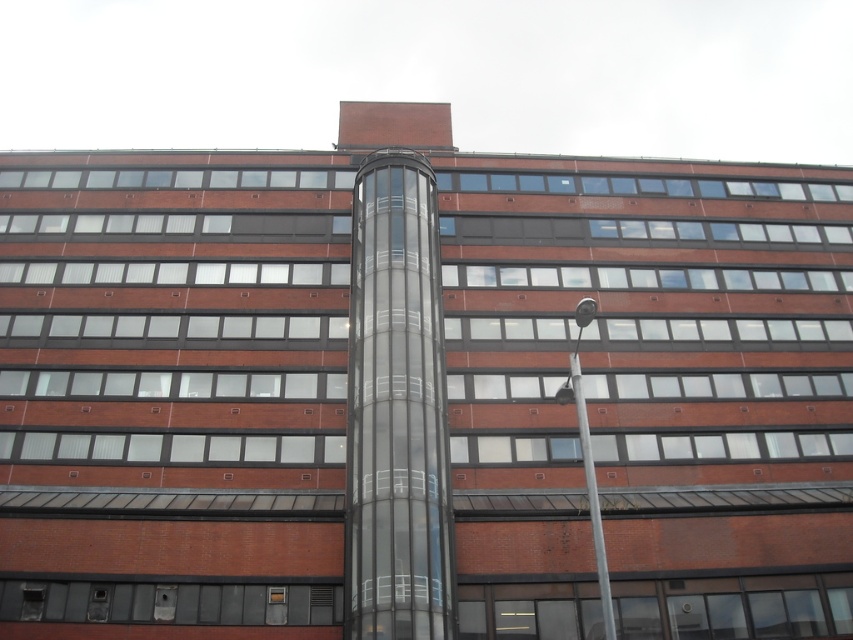
What do you see at coordinates (396, 410) in the screenshot? This screenshot has height=640, width=853. I see `transparent glass elevator at center` at bounding box center [396, 410].

Is transparent glass elevator at center shorter than silver metallic pole at upper right?

No, transparent glass elevator at center is not shorter than silver metallic pole at upper right.

At what (x,y) coordinates should I click in order to perform the action: click on transparent glass elevator at center. Please return your answer as a coordinate pair (x, y). The image size is (853, 640). Looking at the image, I should click on (396, 410).